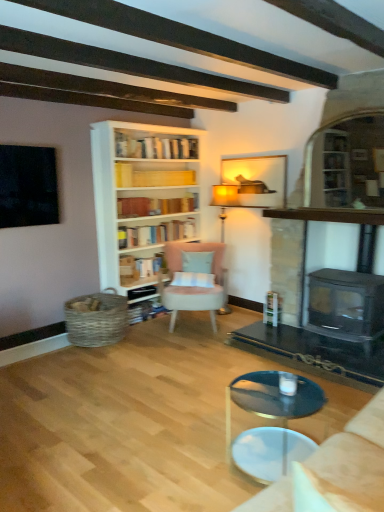
Question: From the image's perspective, is matte wooden picture frame at upper center above pink fabric chair at center?

Choices:
 (A) yes
 (B) no

Answer: (A)

Question: Is matte wooden picture frame at upper center outside pink fabric chair at center?

Choices:
 (A) no
 (B) yes

Answer: (B)

Question: Does matte wooden picture frame at upper center turn towards pink fabric chair at center?

Choices:
 (A) no
 (B) yes

Answer: (A)

Question: Can you confirm if matte wooden picture frame at upper center is thinner than pink fabric chair at center?

Choices:
 (A) yes
 (B) no

Answer: (A)

Question: Is matte wooden picture frame at upper center wider than pink fabric chair at center?

Choices:
 (A) yes
 (B) no

Answer: (B)

Question: Considering the positions of light blue fabric pillow at center and beige fabric studio couch at lower right in the image, is light blue fabric pillow at center bigger or smaller than beige fabric studio couch at lower right?

Choices:
 (A) small
 (B) big

Answer: (A)

Question: Considering the relative positions of light blue fabric pillow at center and beige fabric studio couch at lower right in the image provided, is light blue fabric pillow at center to the left or to the right of beige fabric studio couch at lower right?

Choices:
 (A) left
 (B) right

Answer: (A)

Question: From the image's perspective, is light blue fabric pillow at center above or below beige fabric studio couch at lower right?

Choices:
 (A) above
 (B) below

Answer: (A)

Question: Choose the correct answer: Is light blue fabric pillow at center inside beige fabric studio couch at lower right or outside it?

Choices:
 (A) outside
 (B) inside

Answer: (A)

Question: In the image, is clear glass coffee table at center on the left side or the right side of hardcover books at center, which appears as the third book when ordered from the bottom?

Choices:
 (A) right
 (B) left

Answer: (A)

Question: Is clear glass coffee table at center wider or thinner than hardcover books at center, which appears as the third book when ordered from the bottom?

Choices:
 (A) wide
 (B) thin

Answer: (A)

Question: Considering the positions of clear glass coffee table at center and hardcover books at center, arranged as the second book when viewed from the top, in the image, is clear glass coffee table at center bigger or smaller than hardcover books at center, arranged as the second book when viewed from the top,?

Choices:
 (A) small
 (B) big

Answer: (B)

Question: From a real-world perspective, relative to hardcover books at center, arranged as the second book when viewed from the top, is clear glass coffee table at center vertically above or below?

Choices:
 (A) above
 (B) below

Answer: (B)

Question: Is matte gold floor lamp at center taller or shorter than yellow paper at upper center, which is counted as the fourth book, starting from the bottom?

Choices:
 (A) tall
 (B) short

Answer: (A)

Question: Is matte gold floor lamp at center bigger or smaller than yellow paper at upper center, arranged as the 1th book when viewed from the top?

Choices:
 (A) big
 (B) small

Answer: (A)